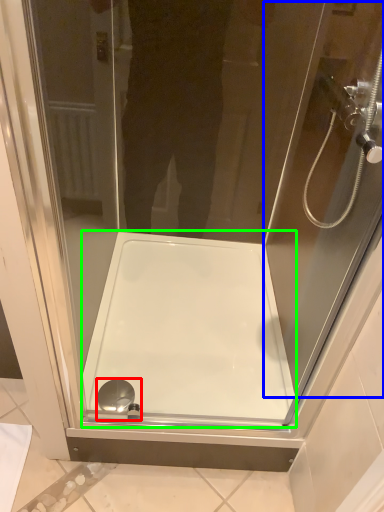
Question: Based on their relative distances, which object is nearer to shower (highlighted by a red box)? Choose from screen door (highlighted by a blue box) and bath (highlighted by a green box).

Choices:
 (A) screen door
 (B) bath

Answer: (B)